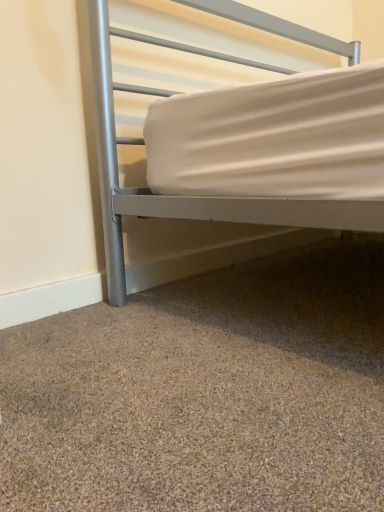
Question: Based on their sizes in the image, would you say brown textured carpet at lower center is bigger or smaller than silver metallic bed at upper center?

Choices:
 (A) big
 (B) small

Answer: (B)

Question: Does point (180, 486) appear closer or farther from the camera than point (365, 229)?

Choices:
 (A) farther
 (B) closer

Answer: (B)

Question: From their relative heights in the image, would you say brown textured carpet at lower center is taller or shorter than silver metallic bed at upper center?

Choices:
 (A) tall
 (B) short

Answer: (B)

Question: In the image, is silver metallic bed at upper center positioned in front of or behind brown textured carpet at lower center?

Choices:
 (A) front
 (B) behind

Answer: (B)

Question: From a real-world perspective, is silver metallic bed at upper center physically located above or below brown textured carpet at lower center?

Choices:
 (A) below
 (B) above

Answer: (B)

Question: From the image's perspective, is silver metallic bed at upper center positioned above or below brown textured carpet at lower center?

Choices:
 (A) below
 (B) above

Answer: (B)

Question: Looking at their shapes, would you say silver metallic bed at upper center is wider or thinner than brown textured carpet at lower center?

Choices:
 (A) wide
 (B) thin

Answer: (B)